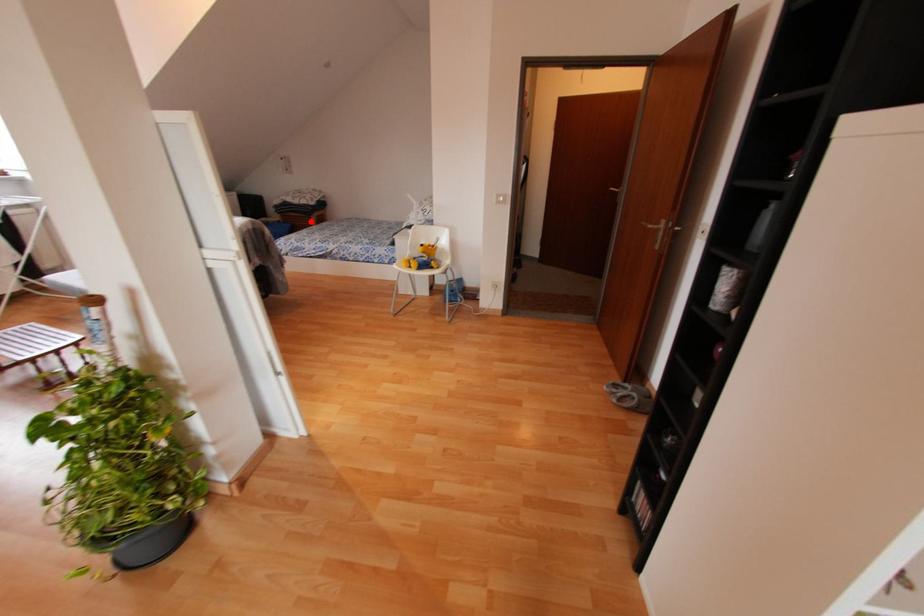
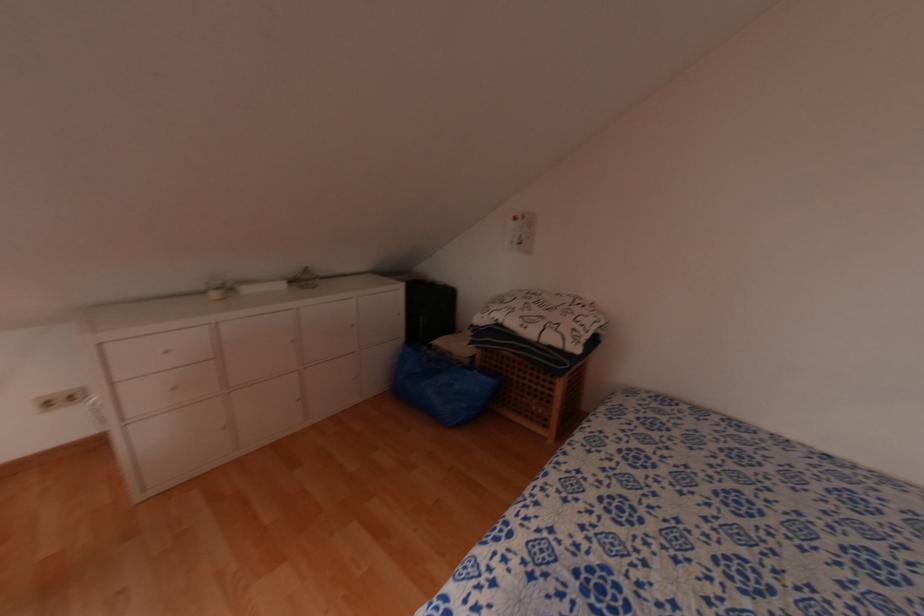
The point at the highlighted location is marked in the first image. Where is the corresponding point in the second image?

(552, 384)